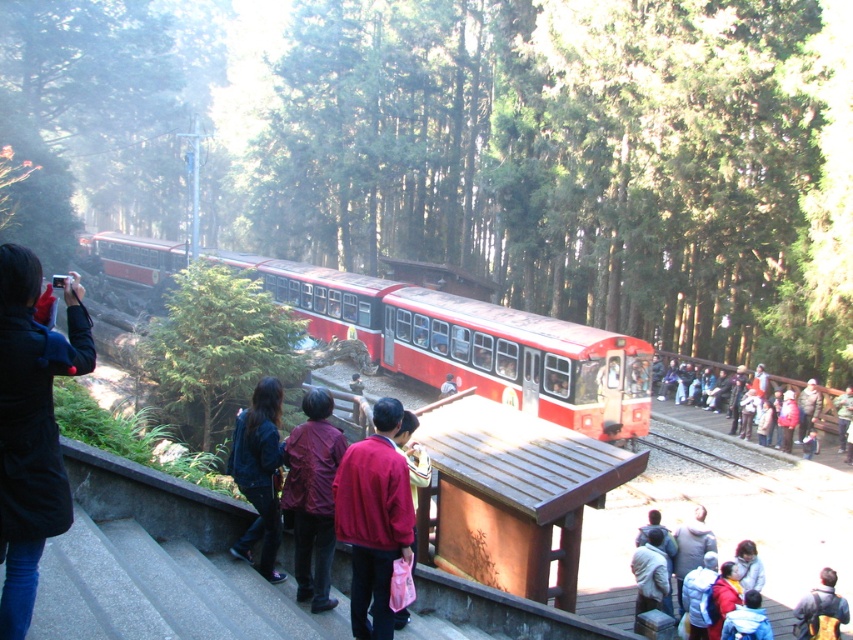
Question: Is red fabric crowd at right further to the viewer compared to light gray fabric jacket at lower right?

Choices:
 (A) no
 (B) yes

Answer: (B)

Question: Is maroon fabric jacket at center positioned before light blue denim jacket at lower right?

Choices:
 (A) yes
 (B) no

Answer: (A)

Question: Which of the following is the closest to the observer?

Choices:
 (A) (650, 579)
 (B) (483, 372)

Answer: (A)

Question: Which of the following is the farthest from the observer?

Choices:
 (A) denim jacket at lower left
 (B) dark blue jacket at lower right
 (C) black fabric jacket at left

Answer: (B)

Question: Which point is closer to the camera taking this photo?

Choices:
 (A) (682, 547)
 (B) (294, 545)
 (C) (610, 340)

Answer: (B)

Question: Does light gray fabric jacket at lower right come behind dark blue jacket at lower right?

Choices:
 (A) yes
 (B) no

Answer: (A)